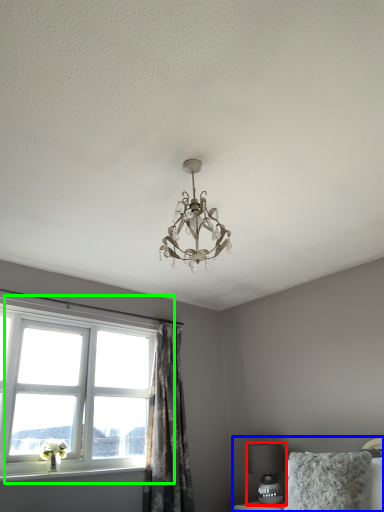
Question: Estimate the real-world distances between objects in this image. Which object is farther from table lamp (highlighted by a red box), bed (highlighted by a blue box) or window (highlighted by a green box)?

Choices:
 (A) bed
 (B) window

Answer: (B)